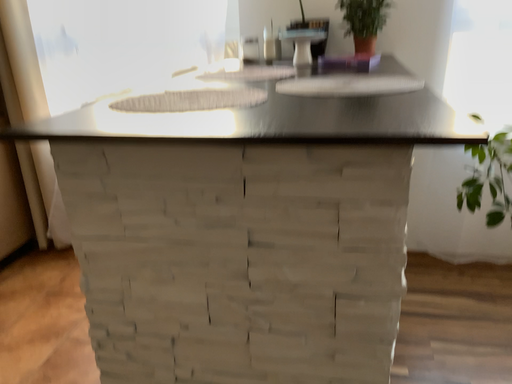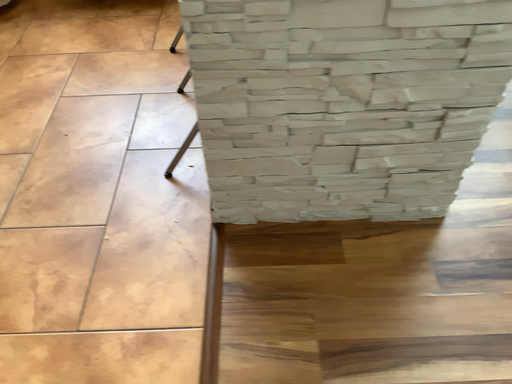
Question: Which way did the camera rotate in the video?

Choices:
 (A) rotated downward
 (B) rotated upward

Answer: (A)